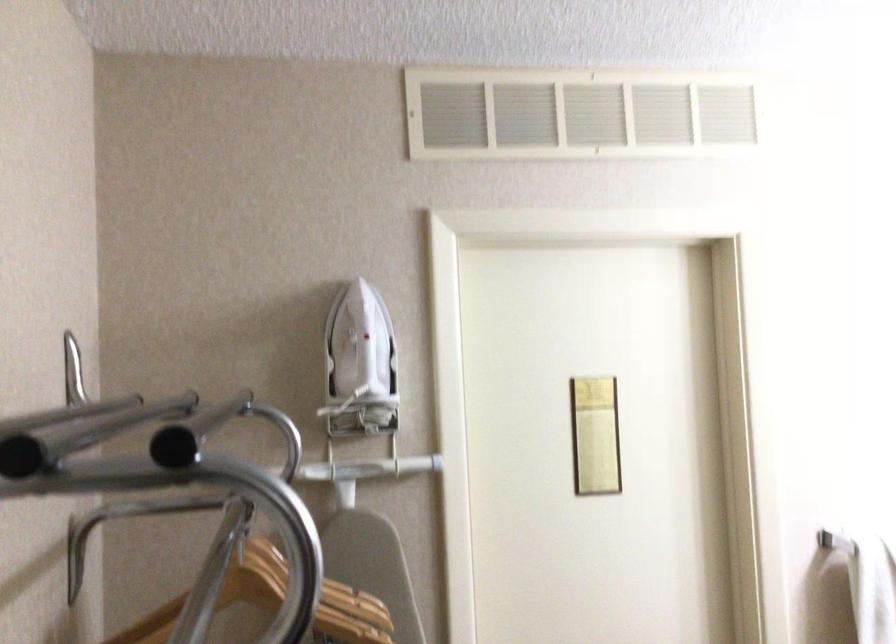
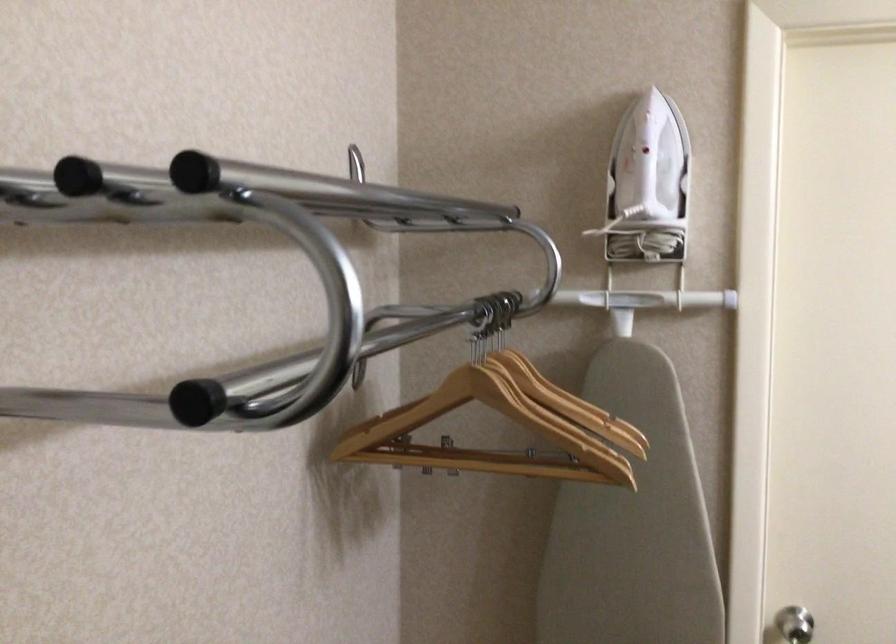
Where in the second image is the point corresponding to pixel 280 556 from the first image?

(538, 377)